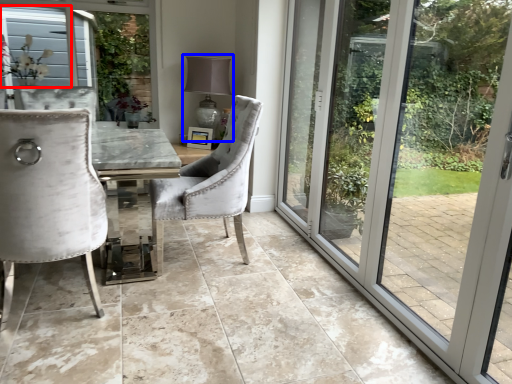
Question: Which object appears farthest to the camera in this image, window screen (highlighted by a red box) or lamp (highlighted by a blue box)?

Choices:
 (A) window screen
 (B) lamp

Answer: (B)